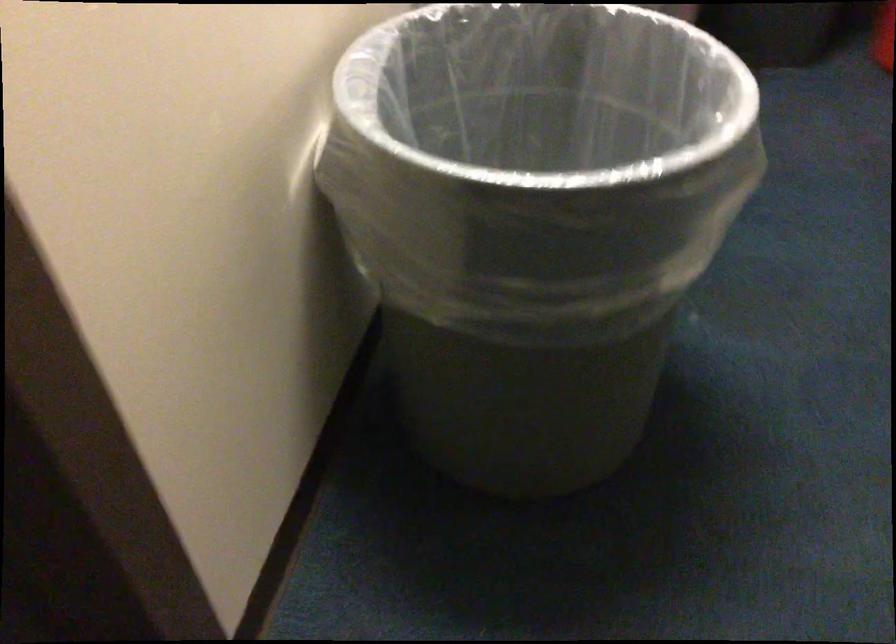
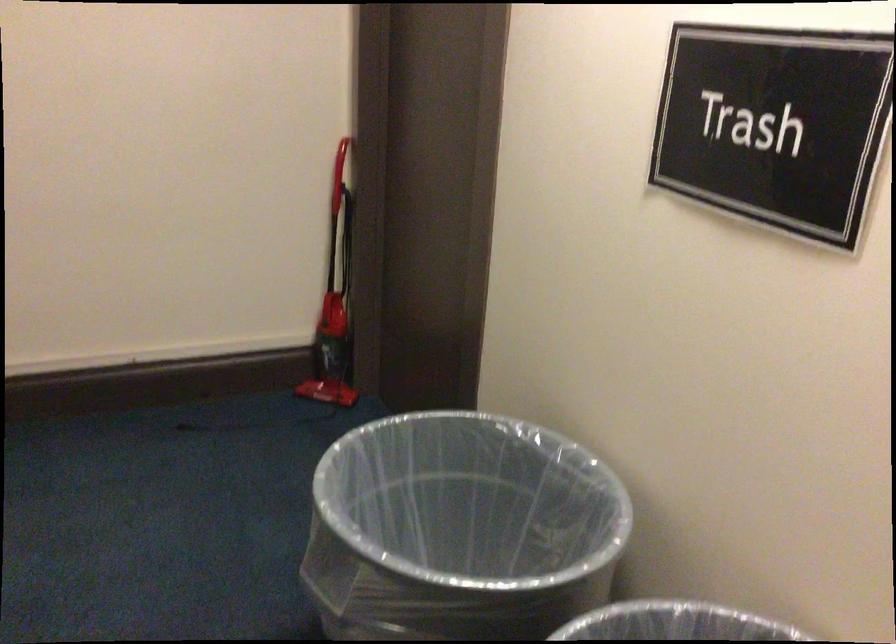
Find the pixel in the second image that matches point (453, 307) in the first image.

(460, 529)